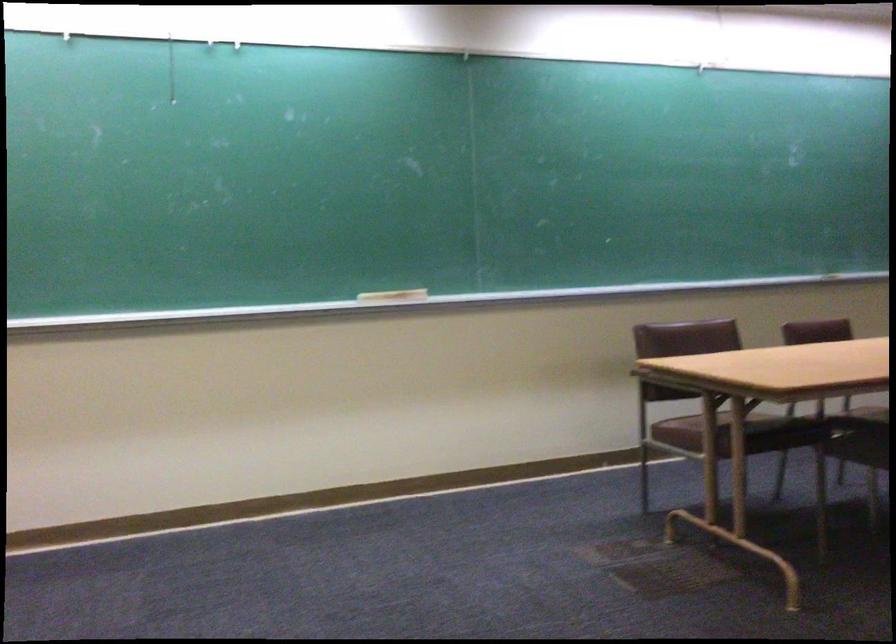
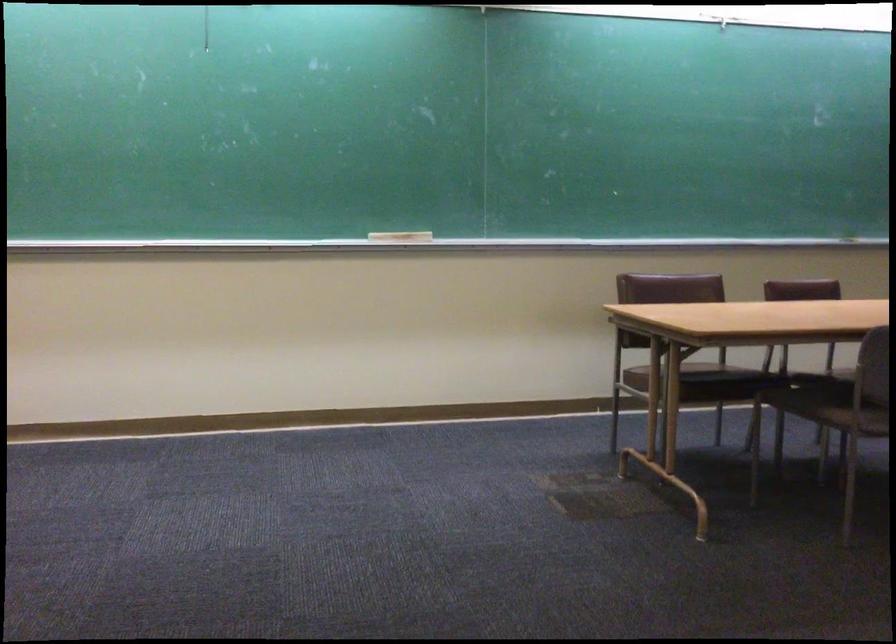
Which direction would the cameraman need to move to produce the second image?

The cameraman moved toward right, backward.